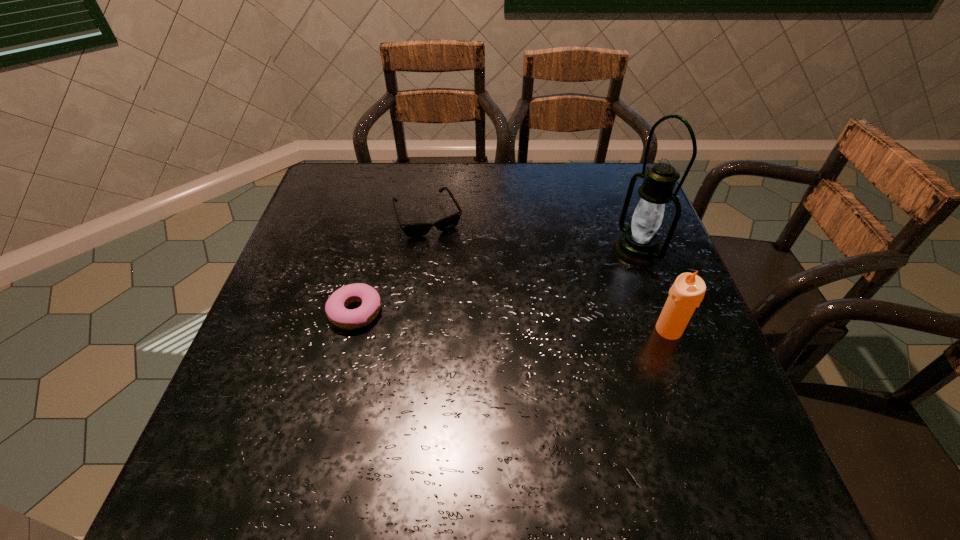
Locate an element on the screen. This screenshot has width=960, height=540. unoccupied position between the tallest object and the doughnut is located at coordinates (496, 281).

Find the location of a particular element. The width and height of the screenshot is (960, 540). vacant space in between the second tallest object and the tallest object is located at coordinates (653, 290).

Where is `empty space that is in between the second tallest object and the second shortest object`? empty space that is in between the second tallest object and the second shortest object is located at coordinates (549, 274).

You are a GUI agent. You are given a task and a screenshot of the screen. Output one action in this format:
    pyautogui.click(x=<x>, y=<y>)
    Task: Click on the object that is the closest one to the third tallest object
    
    Given the screenshot: What is the action you would take?
    pyautogui.click(x=335, y=308)

Identify which object is located as the third nearest to the candle. Please provide its 2D coordinates. Your answer should be formatted as a tuple, i.e. [(x, y)], where the tuple contains the x and y coordinates of a point satisfying the conditions above.

[(335, 308)]

Locate an element on the screen. vacant point that satisfies the following two spatial constraints: 1. on the front side of the lantern; 2. on the right side of the second shortest object is located at coordinates (424, 250).

Where is `vacant area in the image that satisfies the following two spatial constraints: 1. on the front side of the lantern; 2. on the right side of the second tallest object`? This screenshot has height=540, width=960. vacant area in the image that satisfies the following two spatial constraints: 1. on the front side of the lantern; 2. on the right side of the second tallest object is located at coordinates (665, 330).